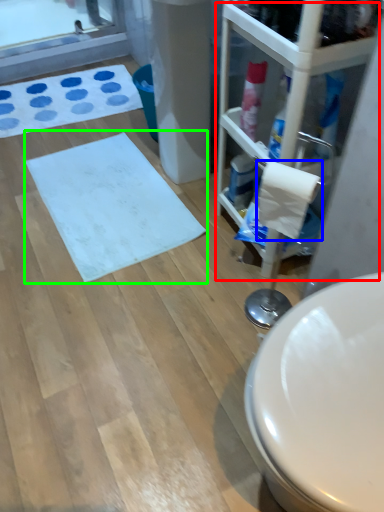
Question: Estimate the real-world distances between objects in this image. Which object is closer to glass door (highlighted by a red box), toilet paper (highlighted by a blue box) or bath mat (highlighted by a green box)?

Choices:
 (A) toilet paper
 (B) bath mat

Answer: (A)